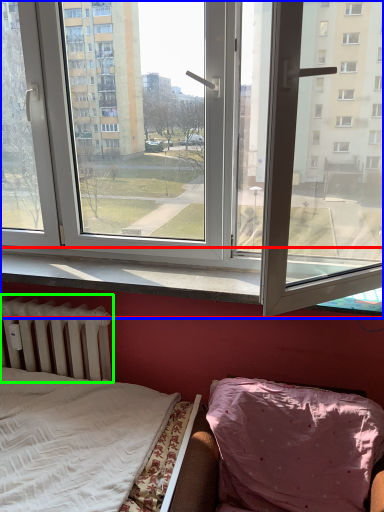
Question: Which object is positioned closest to window sill (highlighted by a red box)? Select from window (highlighted by a blue box) and radiator (highlighted by a green box).

Choices:
 (A) window
 (B) radiator

Answer: (B)